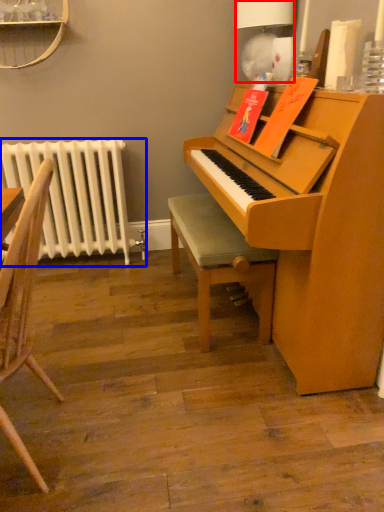
Question: Which object is closer to the camera taking this photo, lamp (highlighted by a red box) or radiator (highlighted by a blue box)?

Choices:
 (A) lamp
 (B) radiator

Answer: (A)